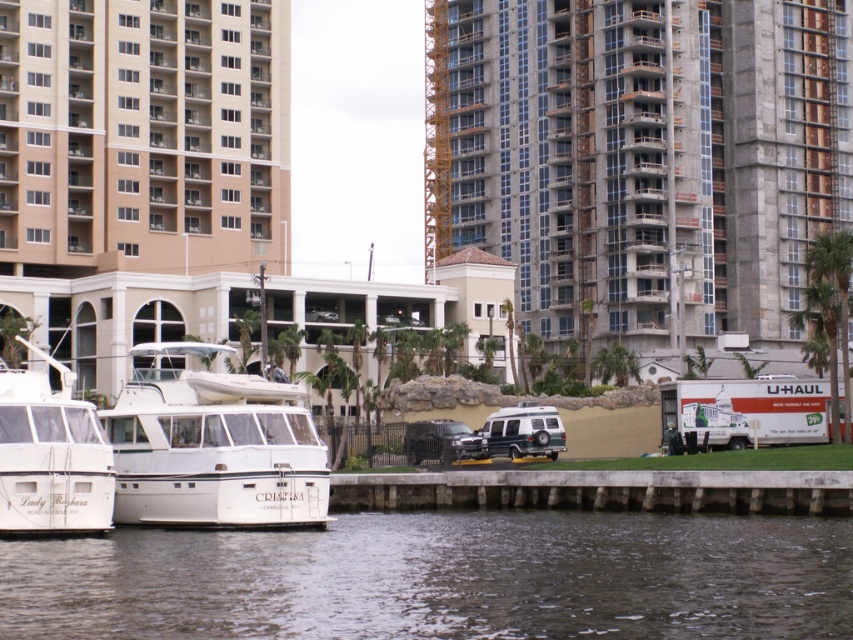
Question: Which object is closer to the camera taking this photo?

Choices:
 (A) green matte van at center
 (B) white glossy boat at left

Answer: (B)

Question: Which point is farther to the camera?

Choices:
 (A) (785, 150)
 (B) (111, 490)
 (C) (521, 410)

Answer: (A)

Question: Is dark gray water at lower center closer to camera compared to beige concrete building at upper left?

Choices:
 (A) no
 (B) yes

Answer: (B)

Question: Observing the image, what is the correct spatial positioning of dark gray water at lower center in reference to white glossy boat at center?

Choices:
 (A) below
 (B) above

Answer: (A)

Question: Which object is the closest to the white glossy boat at left?

Choices:
 (A) green matte van at center
 (B) concrete building at center
 (C) dark gray water at lower center

Answer: (C)

Question: Observing the image, what is the correct spatial positioning of beige concrete building at upper left in reference to white glossy boat at center?

Choices:
 (A) above
 (B) below

Answer: (A)